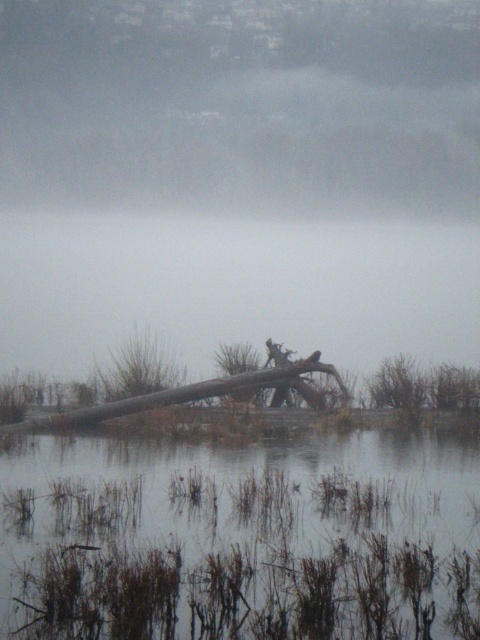
Who is higher up, brown grassy water at lower center or transparent water at center?

transparent water at center is higher up.

Can you confirm if brown grassy water at lower center is positioned to the left of transparent water at center?

Indeed, brown grassy water at lower center is positioned on the left side of transparent water at center.

Which is behind, point (59, 493) or point (237, 269)?

Positioned behind is point (237, 269).

Where is `brown grassy water at lower center`? Image resolution: width=480 pixels, height=640 pixels. brown grassy water at lower center is located at coordinates (240, 538).

Does foggy mist at upper center have a lesser height compared to transparent water at center?

No, foggy mist at upper center is not shorter than transparent water at center.

Which is in front, point (79, 129) or point (383, 237)?

Point (383, 237)

Does point (160, 138) come behind point (399, 220)?

Yes, point (160, 138) is behind point (399, 220).

This screenshot has height=640, width=480. I want to click on foggy mist at upper center, so click(241, 99).

Which is above, brown grassy water at lower center or foggy mist at upper center?

foggy mist at upper center is higher up.

Does brown grassy water at lower center lie in front of foggy mist at upper center?

That is True.

In order to click on brown grassy water at lower center in this screenshot , I will do `click(240, 538)`.